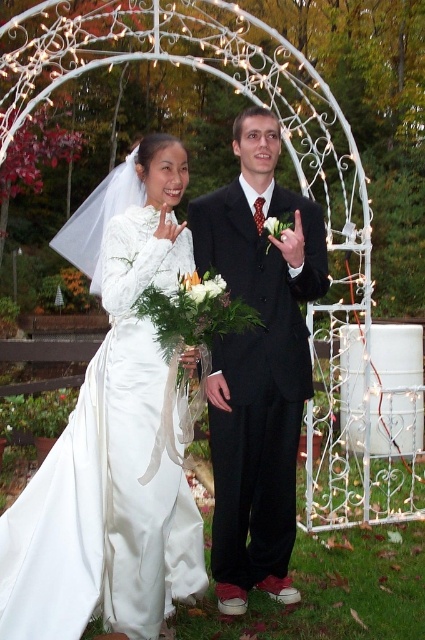
You are planning to seat guests at a long rectangular table for a reception dinner. The table has a width of 1.2 meters. You need to place a chair for the person wearing the white satin dress at left and another chair for the person in the matte black suit at center. Considering their clothing, will both chairs fit side by side on the table without overlapping?

The white satin dress at left might be wider than the matte black suit at center. If the white satin dress at left is wider, the total width required for both chairs could exceed the table width of 1.2 meters, so they might not fit. If the dress is not wider, they might fit. However, since the exact width difference isn

In the wedding scene, where is the white satin dress at left located in terms of coordinates?

The white satin dress at left is located at point (107, 477).